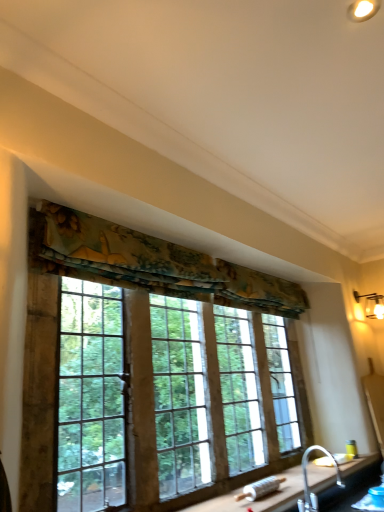
In order to click on matte white wall sconce at upper right in this screenshot , I will do `click(372, 305)`.

The height and width of the screenshot is (512, 384). What are the coordinates of `silver metallic faucet at lower right` in the screenshot? It's located at (307, 480).

Where is `black granite countertop at lower right`? This screenshot has width=384, height=512. black granite countertop at lower right is located at coordinates (260, 499).

Where is `textured floral fabric at upper center`? This screenshot has height=512, width=384. textured floral fabric at upper center is located at coordinates (151, 263).

Does point (348, 471) lie in front of point (83, 228)?

No, (348, 471) is behind (83, 228).

Do you think black granite countertop at lower right is within textured floral fabric at upper center, or outside of it?

black granite countertop at lower right is not enclosed by textured floral fabric at upper center.

Is black granite countertop at lower right next to textured floral fabric at upper center and touching it?

No, black granite countertop at lower right is not beside textured floral fabric at upper center.

Is black granite countertop at lower right taller than textured floral fabric at upper center?

No, black granite countertop at lower right is not taller than textured floral fabric at upper center.

Is black granite countertop at lower right positioned with its back to textured fabric valance at upper center?

No, black granite countertop at lower right's orientation is not away from textured fabric valance at upper center.

Choose the correct answer: Is black granite countertop at lower right inside textured fabric valance at upper center or outside it?

black granite countertop at lower right is not inside textured fabric valance at upper center, it's outside.

Would you say silver metallic faucet at lower right is to the left or to the right of textured floral fabric at upper center in the picture?

In the image, silver metallic faucet at lower right appears on the right side of textured floral fabric at upper center.

From a real-world perspective, is silver metallic faucet at lower right located beneath textured floral fabric at upper center?

Yes, from a real-world perspective, silver metallic faucet at lower right is below textured floral fabric at upper center.

Is silver metallic faucet at lower right in contact with textured floral fabric at upper center?

No, silver metallic faucet at lower right is not with textured floral fabric at upper center.

From the image's perspective, which is above, silver metallic faucet at lower right or textured floral fabric at upper center?

textured floral fabric at upper center is shown above in the image.

Which of these two, matte white wall sconce at upper right or textured fabric valance at upper center, is smaller?

matte white wall sconce at upper right.

From a real-world perspective, which is physically above, matte white wall sconce at upper right or textured fabric valance at upper center?

From a 3D spatial view, matte white wall sconce at upper right is above.

From the picture: From the image's perspective, would you say matte white wall sconce at upper right is positioned over textured fabric valance at upper center?

Indeed, from the image's perspective, matte white wall sconce at upper right is shown above textured fabric valance at upper center.

Based on the photo, which is correct: matte white wall sconce at upper right is inside textured fabric valance at upper center, or outside of it?

The correct answer is: outside.

How many degrees apart are the facing directions of matte white wall sconce at upper right and textured floral fabric at upper center?

The angle between the facing direction of matte white wall sconce at upper right and the facing direction of textured floral fabric at upper center is 0.572 degrees.

Is matte white wall sconce at upper right outside of textured floral fabric at upper center?

Yes, matte white wall sconce at upper right is not within textured floral fabric at upper center.

Is matte white wall sconce at upper right at the left side of textured floral fabric at upper center?

Incorrect, matte white wall sconce at upper right is not on the left side of textured floral fabric at upper center.

Considering the sizes of objects matte white wall sconce at upper right and textured floral fabric at upper center in the image provided, who is smaller, matte white wall sconce at upper right or textured floral fabric at upper center?

matte white wall sconce at upper right.

Locate an element on the screen. The image size is (384, 512). window on the left of the matte white wall sconce at upper right is located at coordinates (145, 384).

Is textured fabric valance at upper center aimed at matte white wall sconce at upper right?

No, textured fabric valance at upper center is not facing towards matte white wall sconce at upper right.

Is textured fabric valance at upper center positioned far away from matte white wall sconce at upper right?

textured fabric valance at upper center is positioned a significant distance from matte white wall sconce at upper right.

Between textured fabric valance at upper center and matte white wall sconce at upper right, which one has smaller width?

Thinner between the two is textured fabric valance at upper center.

Is textured fabric valance at upper center directly adjacent to black granite countertop at lower right?

No, textured fabric valance at upper center is not beside black granite countertop at lower right.

The image size is (384, 512). Identify the location of counter top on the right of textured fabric valance at upper center. (260, 499).

Which object is further away from the camera taking this photo, textured fabric valance at upper center or black granite countertop at lower right?

black granite countertop at lower right is further away from the camera.

This screenshot has width=384, height=512. I want to click on counter top that is below the textured floral fabric at upper center (from the image's perspective), so click(260, 499).

This screenshot has width=384, height=512. I want to click on window above the black granite countertop at lower right (from a real-world perspective), so click(145, 384).

Based on their spatial positions, is textured floral fabric at upper center or silver metallic faucet at lower right further from black granite countertop at lower right?

Among the two, textured floral fabric at upper center is located further to black granite countertop at lower right.

Which object lies nearer to the anchor point black granite countertop at lower right, textured floral fabric at upper center or matte white wall sconce at upper right?

textured floral fabric at upper center.

Based on their spatial positions, is silver metallic faucet at lower right or black granite countertop at lower right closer to textured floral fabric at upper center?

black granite countertop at lower right lies closer to textured floral fabric at upper center than the other object.

Based on the photo, considering their positions, is black granite countertop at lower right positioned closer to silver metallic faucet at lower right than matte white wall sconce at upper right?

black granite countertop at lower right is closer to silver metallic faucet at lower right.

Estimate the real-world distances between objects in this image. Which object is further from silver metallic faucet at lower right, black granite countertop at lower right or textured fabric valance at upper center?

Among the two, textured fabric valance at upper center is located further to silver metallic faucet at lower right.

Based on their spatial positions, is matte white wall sconce at upper right or silver metallic faucet at lower right closer to textured floral fabric at upper center?

silver metallic faucet at lower right is closer to textured floral fabric at upper center.

Estimate the real-world distances between objects in this image. Which object is closer to textured fabric valance at upper center, silver metallic faucet at lower right or matte white wall sconce at upper right?

silver metallic faucet at lower right lies closer to textured fabric valance at upper center than the other object.

Estimate the real-world distances between objects in this image. Which object is further from silver metallic faucet at lower right, textured floral fabric at upper center or black granite countertop at lower right?

The object further to silver metallic faucet at lower right is textured floral fabric at upper center.

Identify the location of window between textured floral fabric at upper center and black granite countertop at lower right in the up-down direction. This screenshot has width=384, height=512. [x=145, y=384].

This screenshot has width=384, height=512. Identify the location of counter top located between textured fabric valance at upper center and matte white wall sconce at upper right in the depth direction. (260, 499).

Find the location of a particular element. The width and height of the screenshot is (384, 512). faucet positioned between black granite countertop at lower right and matte white wall sconce at upper right from near to far is located at coordinates (307, 480).

This screenshot has width=384, height=512. Identify the location of curtain located between textured fabric valance at upper center and matte white wall sconce at upper right in the depth direction. (151, 263).